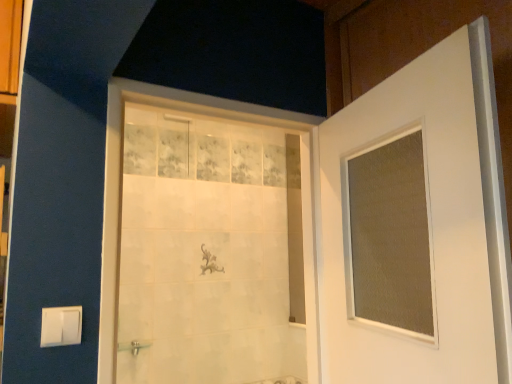
The height and width of the screenshot is (384, 512). What do you see at coordinates (417, 226) in the screenshot?
I see `white matte door at center` at bounding box center [417, 226].

The image size is (512, 384). What are the coordinates of `white matte door at center` in the screenshot? It's located at (417, 226).

This screenshot has height=384, width=512. I want to click on white matte door at center, so click(x=417, y=226).